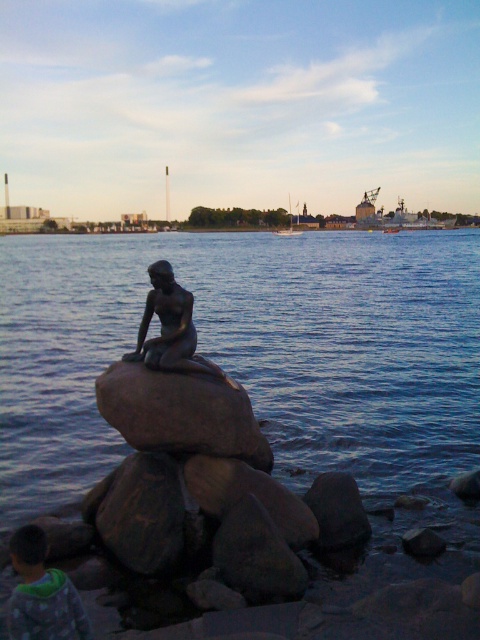
You are a photographer planning to capture the statue of The Little Mermaid against the waterfront backdrop. Given that the blue water at center and brown rough rock at center are both in your frame, which object occupies more space in the image?

The blue water at center occupies more space in the image as it is bigger than the brown rough rock at center according to the description.